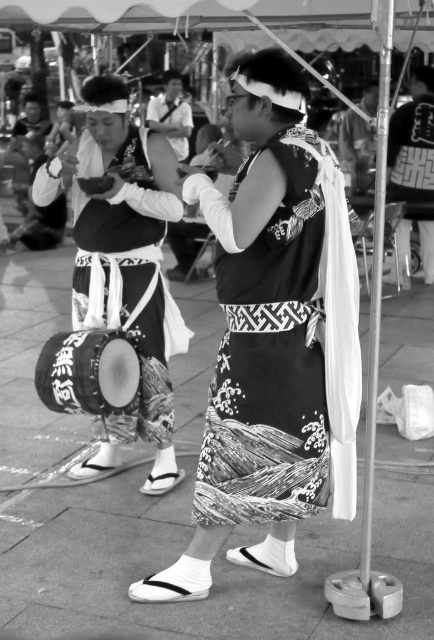
Is black printed fabric dress at center bigger than smooth fabric kimono at center?

Incorrect, black printed fabric dress at center is not larger than smooth fabric kimono at center.

What do you see at coordinates (285, 353) in the screenshot? This screenshot has width=434, height=640. I see `black printed fabric dress at center` at bounding box center [285, 353].

Locate an element on the screen. black printed fabric dress at center is located at coordinates (285, 353).

Between black fabric drum at left and smooth fabric kimono at center, which one appears on the right side from the viewer's perspective?

black fabric drum at left

Is point (177, 339) positioned after point (178, 150)?

No, it is not.

Image resolution: width=434 pixels, height=640 pixels. Describe the element at coordinates (124, 266) in the screenshot. I see `black fabric drum at left` at that location.

At what (x,y) coordinates should I click in order to perform the action: click on black fabric drum at left. Please return your answer as a coordinate pair (x, y). This screenshot has height=640, width=434. Looking at the image, I should click on click(124, 266).

Identify the location of black fabric drum at left. (124, 266).

Is black fabric drum at left taller than black drum at center?

Yes, black fabric drum at left is taller than black drum at center.

Identify the location of black fabric drum at left. Image resolution: width=434 pixels, height=640 pixels. (124, 266).